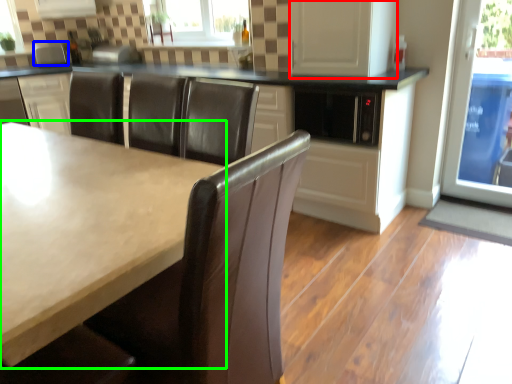
Question: Which object is the farthest from screen door (highlighted by a red box)? Choose among these: appliance (highlighted by a blue box) or countertop (highlighted by a green box).

Choices:
 (A) appliance
 (B) countertop

Answer: (A)